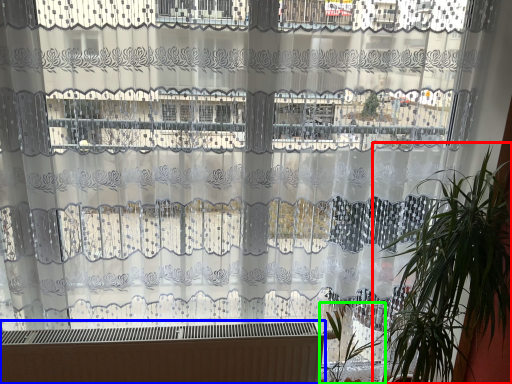
Question: Which object is positioned closest to houseplant (highlighted by a red box)? Select from heater (highlighted by a blue box) and vegetation (highlighted by a green box).

Choices:
 (A) heater
 (B) vegetation

Answer: (B)